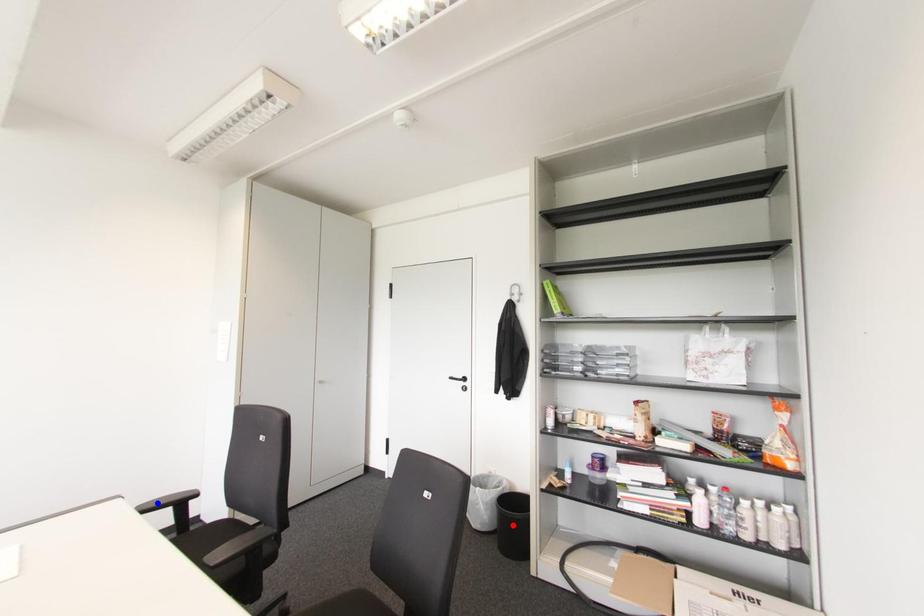
Question: Which of the two points in the image is closer to the camera?

Choices:
 (A) Blue point is closer.
 (B) Red point is closer.

Answer: (A)